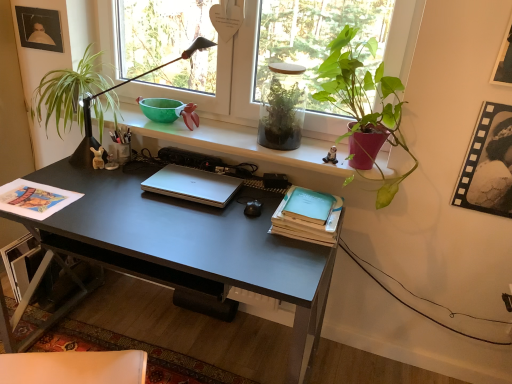
Locate an element on the screen. vacant space in teal matte paperback book at right, the first paperback book when ordered from top to bottom (from a real-world perspective) is located at coordinates 311,213.